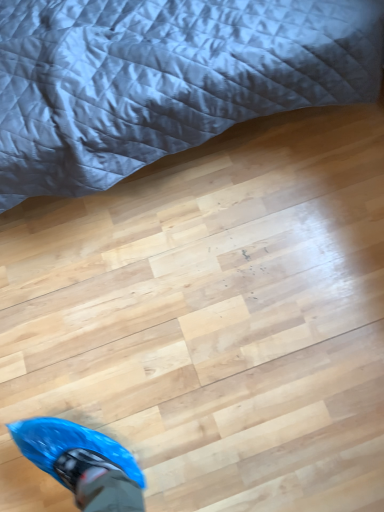
This screenshot has height=512, width=384. What do you see at coordinates (164, 79) in the screenshot?
I see `matte blue quilted bed at upper left` at bounding box center [164, 79].

Find the location of a particular element. The height and width of the screenshot is (512, 384). matte blue quilted bed at upper left is located at coordinates (164, 79).

You are a GUI agent. You are given a task and a screenshot of the screen. Output one action in this format:
    pyautogui.click(x=<x>, y=<y>)
    Task: Click on the matte blue quilted bed at upper left
    This screenshot has height=512, width=384.
    Given the screenshot: What is the action you would take?
    pyautogui.click(x=164, y=79)